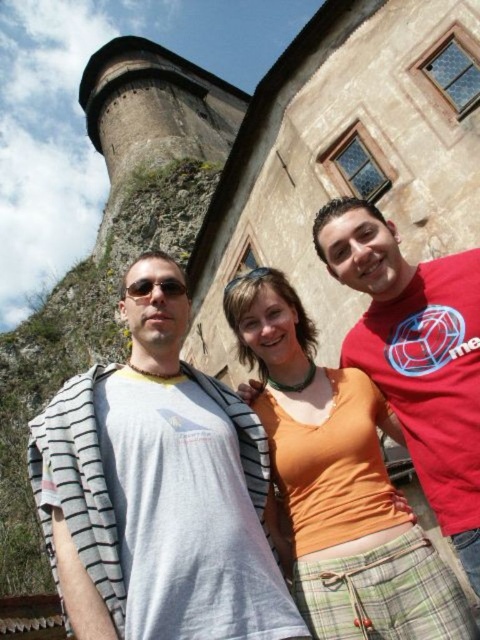
You are a photographer standing at the camera position. You want to capture a closeup shot of the gray striped shirt at left. Considering the distance, is it feasible to take a clear photo without moving closer?

The gray striped shirt at left is 20.53 meters away from the camera. A distance of over 20 meters may make it challenging to capture a clear closeup without specialized equipment or moving closer.